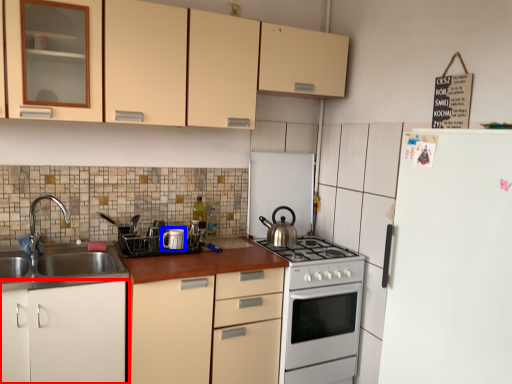
Question: Which point is closer to the camera, cabinetry (highlighted by a red box) or appliance (highlighted by a blue box)?

Choices:
 (A) cabinetry
 (B) appliance

Answer: (A)